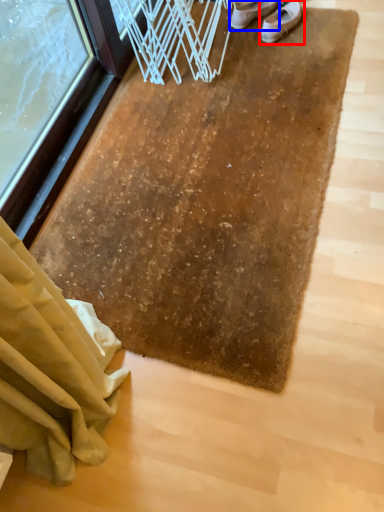
Question: Which object appears closest to the camera in this image, footwear (highlighted by a red box) or footwear (highlighted by a blue box)?

Choices:
 (A) footwear
 (B) footwear

Answer: (A)